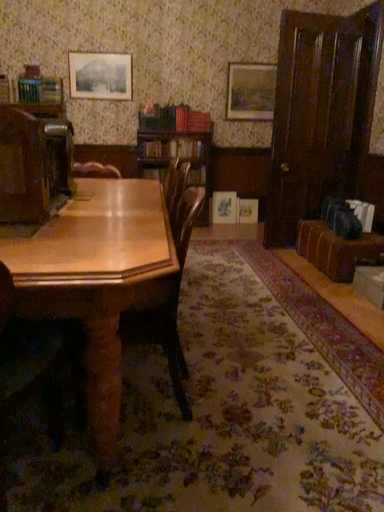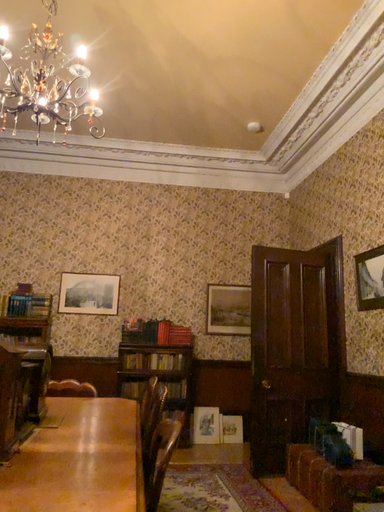
Question: How did the camera likely rotate when shooting the video?

Choices:
 (A) rotated upward
 (B) rotated downward

Answer: (A)